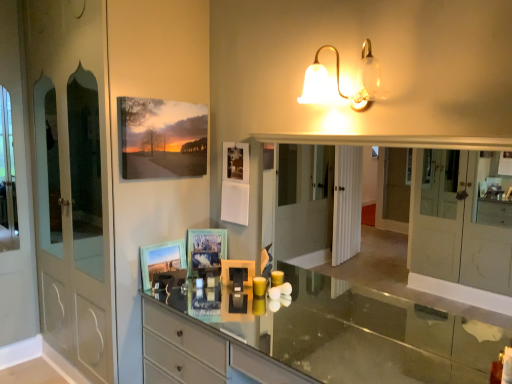
Question: Considering the relative positions of matte canvas painting at upper left, marked as the first picture frame in a top-to-bottom arrangement, and clear glass mirror at center in the image provided, is matte canvas painting at upper left, marked as the first picture frame in a top-to-bottom arrangement, to the left of clear glass mirror at center from the viewer's perspective?

Choices:
 (A) no
 (B) yes

Answer: (B)

Question: Can you confirm if matte canvas painting at upper left, marked as the first picture frame in a top-to-bottom arrangement, is positioned to the right of clear glass mirror at center?

Choices:
 (A) yes
 (B) no

Answer: (B)

Question: Considering the relative sizes of matte canvas painting at upper left, positioned as the third picture frame in bottom-to-top order, and clear glass mirror at center in the image provided, is matte canvas painting at upper left, positioned as the third picture frame in bottom-to-top order, shorter than clear glass mirror at center?

Choices:
 (A) no
 (B) yes

Answer: (B)

Question: Is the depth of matte canvas painting at upper left, positioned as the third picture frame in bottom-to-top order, less than that of clear glass mirror at center?

Choices:
 (A) no
 (B) yes

Answer: (A)

Question: Is matte canvas painting at upper left, positioned as the third picture frame in bottom-to-top order, bigger than clear glass mirror at center?

Choices:
 (A) no
 (B) yes

Answer: (A)

Question: Is clear glass mirror at center taller or shorter than matte blue picture frame at center, which appears as the second picture frame when viewed from the top?

Choices:
 (A) short
 (B) tall

Answer: (B)

Question: Is point (497, 276) closer or farther from the camera than point (192, 241)?

Choices:
 (A) closer
 (B) farther

Answer: (B)

Question: Is clear glass mirror at center situated inside matte blue picture frame at center, which appears as the 2th picture frame when ordered from the bottom, or outside?

Choices:
 (A) outside
 (B) inside

Answer: (A)

Question: Is clear glass mirror at center in front of or behind matte blue picture frame at center, which appears as the 2th picture frame when ordered from the bottom, in the image?

Choices:
 (A) front
 (B) behind

Answer: (A)

Question: Is point (218, 233) closer or farther from the camera than point (154, 127)?

Choices:
 (A) closer
 (B) farther

Answer: (B)

Question: Looking at their shapes, would you say matte blue picture frame at center, which appears as the 2th picture frame when ordered from the bottom, is wider or thinner than matte canvas painting at upper left, marked as the first picture frame in a top-to-bottom arrangement?

Choices:
 (A) thin
 (B) wide

Answer: (A)

Question: Relative to matte canvas painting at upper left, marked as the first picture frame in a top-to-bottom arrangement, is matte blue picture frame at center, which appears as the second picture frame when viewed from the top, in front or behind?

Choices:
 (A) front
 (B) behind

Answer: (B)

Question: Considering the relative positions of matte blue picture frame at center, which appears as the 2th picture frame when ordered from the bottom, and matte canvas painting at upper left, marked as the first picture frame in a top-to-bottom arrangement, in the image provided, is matte blue picture frame at center, which appears as the 2th picture frame when ordered from the bottom, to the left or to the right of matte canvas painting at upper left, marked as the first picture frame in a top-to-bottom arrangement,?

Choices:
 (A) left
 (B) right

Answer: (B)

Question: Considering the positions of matte glass picture frame at center, arranged as the 1th picture frame when ordered from the bottom, and matte blue picture frame at center, which appears as the second picture frame when viewed from the top, in the image, is matte glass picture frame at center, arranged as the 1th picture frame when ordered from the bottom, bigger or smaller than matte blue picture frame at center, which appears as the second picture frame when viewed from the top,?

Choices:
 (A) big
 (B) small

Answer: (A)

Question: Considering the positions of matte glass picture frame at center, the 3th picture frame in the top-to-bottom sequence, and matte blue picture frame at center, which appears as the second picture frame when viewed from the top, in the image, is matte glass picture frame at center, the 3th picture frame in the top-to-bottom sequence, taller or shorter than matte blue picture frame at center, which appears as the second picture frame when viewed from the top,?

Choices:
 (A) short
 (B) tall

Answer: (A)